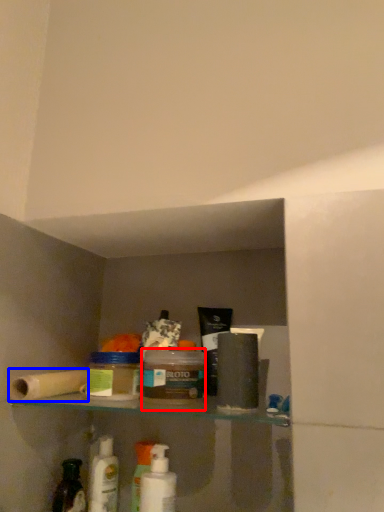
Question: Which object is closer to the camera taking this photo, product (highlighted by a red box) or toilet paper (highlighted by a blue box)?

Choices:
 (A) product
 (B) toilet paper

Answer: (A)